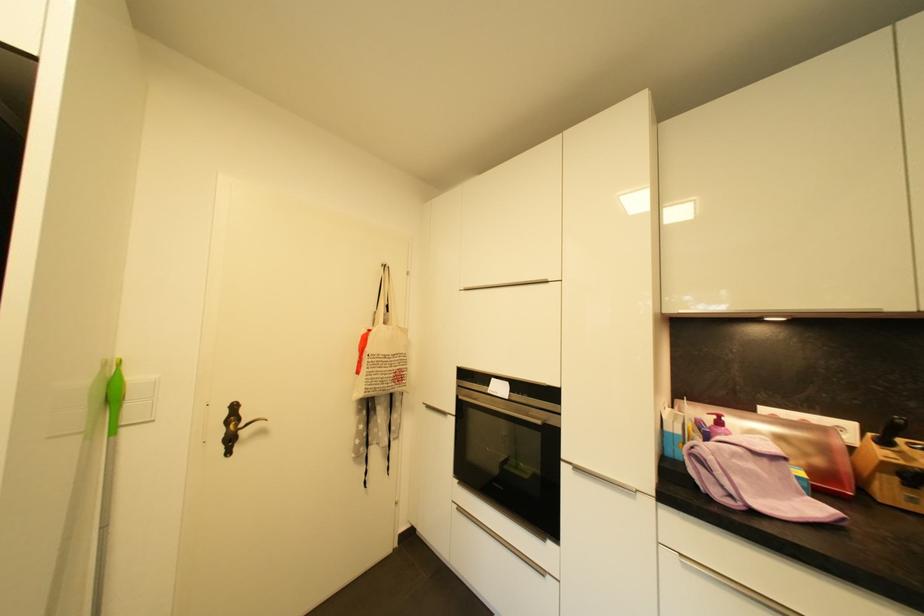
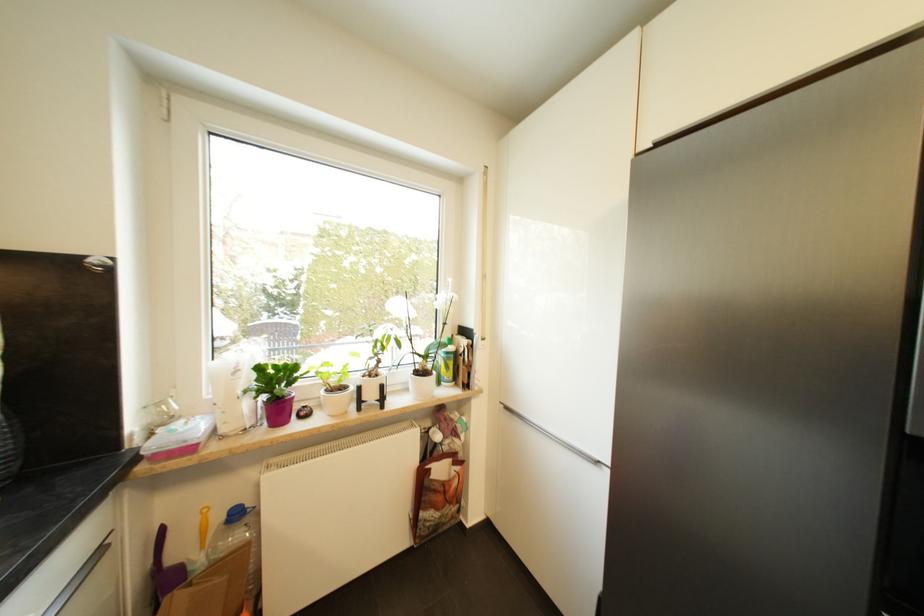
Question: The camera is either moving clockwise (left) or counter-clockwise (right) around the object. The first image is from the beginning of the video and the second image is from the end. Is the camera moving left or right when shooting the video?

Choices:
 (A) Left
 (B) Right

Answer: (B)